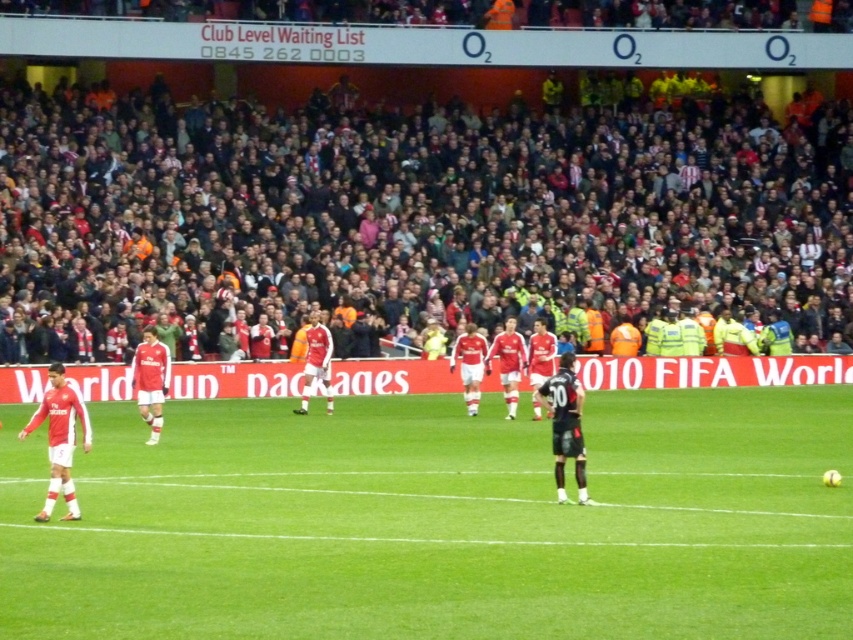
Question: Which object is closer to the camera taking this photo?

Choices:
 (A) green grass field at center
 (B) dark red jersey at upper center

Answer: (A)

Question: Is the position of green grass field at center more distant than that of dark red jersey at upper center?

Choices:
 (A) yes
 (B) no

Answer: (B)

Question: Which is farther from the green grass field at center?

Choices:
 (A) dark red jersey at upper center
 (B) matte red jersey at left

Answer: (A)

Question: Is green grass field at center positioned before dark red jersey at upper center?

Choices:
 (A) yes
 (B) no

Answer: (A)

Question: Is green grass field at center bigger than dark red jersey at upper center?

Choices:
 (A) yes
 (B) no

Answer: (B)

Question: Among these objects, which one is farthest from the camera?

Choices:
 (A) green grass field at center
 (B) matte red jersey at left

Answer: (B)